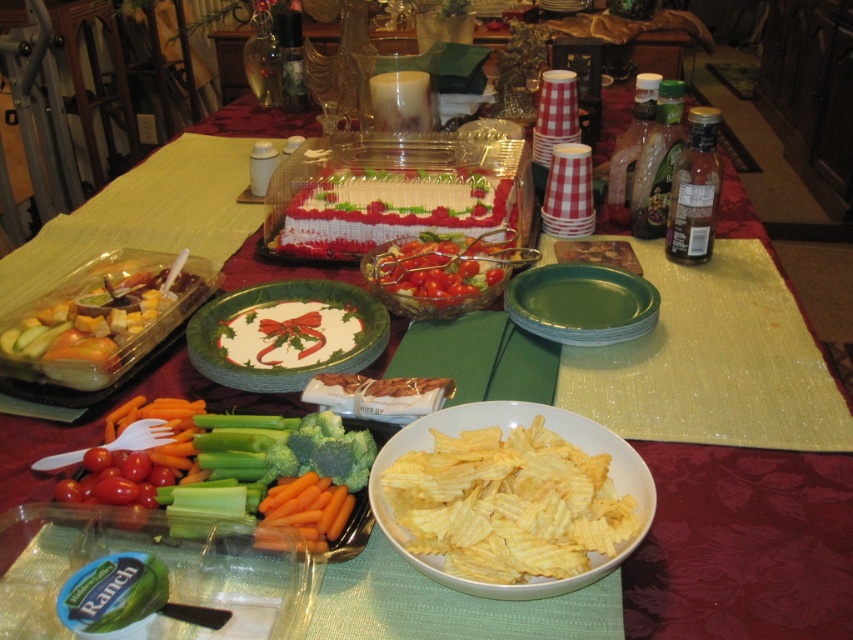
Question: Does green crisp celery at center lie behind translucent glass bowl at center?

Choices:
 (A) yes
 (B) no

Answer: (B)

Question: Is green matte plate at center wider than orange matte carrot at lower center?

Choices:
 (A) no
 (B) yes

Answer: (B)

Question: Which object is closer to the camera taking this photo?

Choices:
 (A) green matte plate at center
 (B) translucent glass bowl at center

Answer: (A)

Question: Among these points, which one is farthest from the camera?

Choices:
 (A) (462, 257)
 (B) (621, 317)

Answer: (A)

Question: Does yellow crispy chips at center have a larger size compared to green matte plate at center?

Choices:
 (A) yes
 (B) no

Answer: (A)

Question: Considering the real-world distances, which object is farthest from the green crisp celery at center?

Choices:
 (A) orange matte carrot at lower center
 (B) white paper plate at center
 (C) translucent glass bowl at center

Answer: (C)